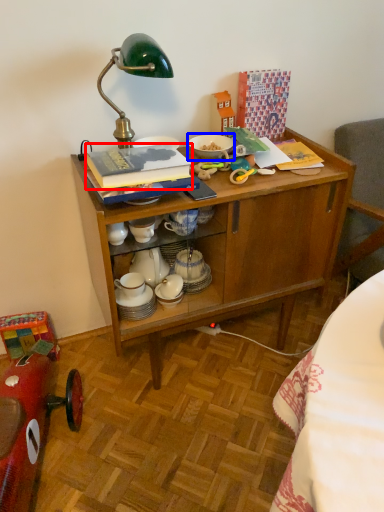
Question: Which point is closer to the camera, book (highlighted by a red box) or tableware (highlighted by a blue box)?

Choices:
 (A) book
 (B) tableware

Answer: (A)